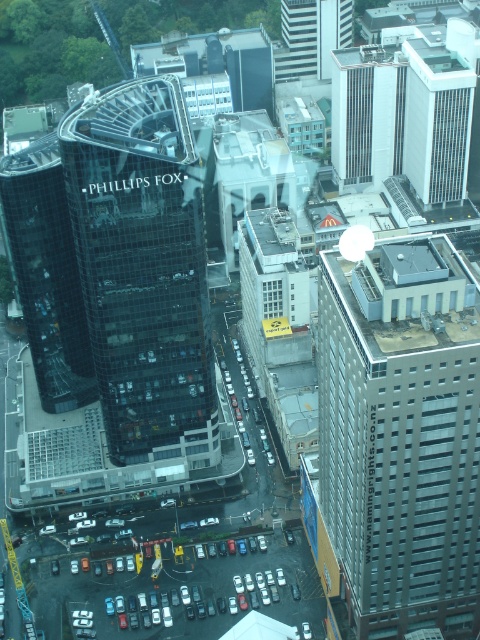
Question: Is shiny glass building at center-left further to the viewer compared to metallic silver tower at upper center?

Choices:
 (A) no
 (B) yes

Answer: (A)

Question: Can you confirm if white glass skyscraper at upper right is thinner than gray concrete building at center?

Choices:
 (A) no
 (B) yes

Answer: (B)

Question: Which of the following is the farthest from the observer?

Choices:
 (A) (324, 56)
 (B) (410, 618)
 (C) (367, 157)
 (D) (63, 284)

Answer: (A)

Question: Is dark glass building at center bigger than metallic silver tower at upper center?

Choices:
 (A) no
 (B) yes

Answer: (B)

Question: Among these objects, which one is nearest to the camera?

Choices:
 (A) dark glass building at center
 (B) metallic silver tower at upper center
 (C) white glass skyscraper at upper right

Answer: (A)

Question: Which point is closer to the camera?

Choices:
 (A) (365, 392)
 (B) (356, 108)
 (C) (344, 13)
 (D) (420, 72)

Answer: (A)